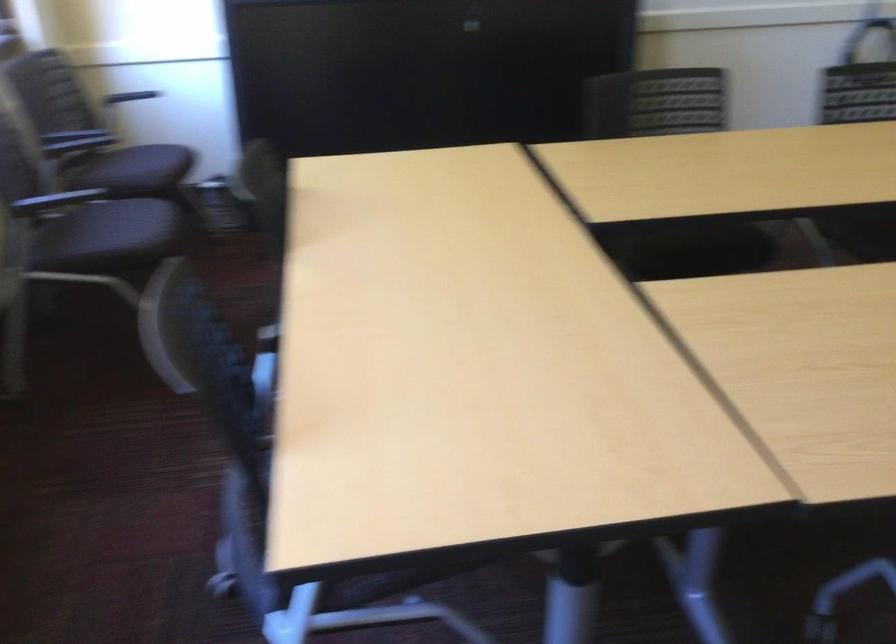
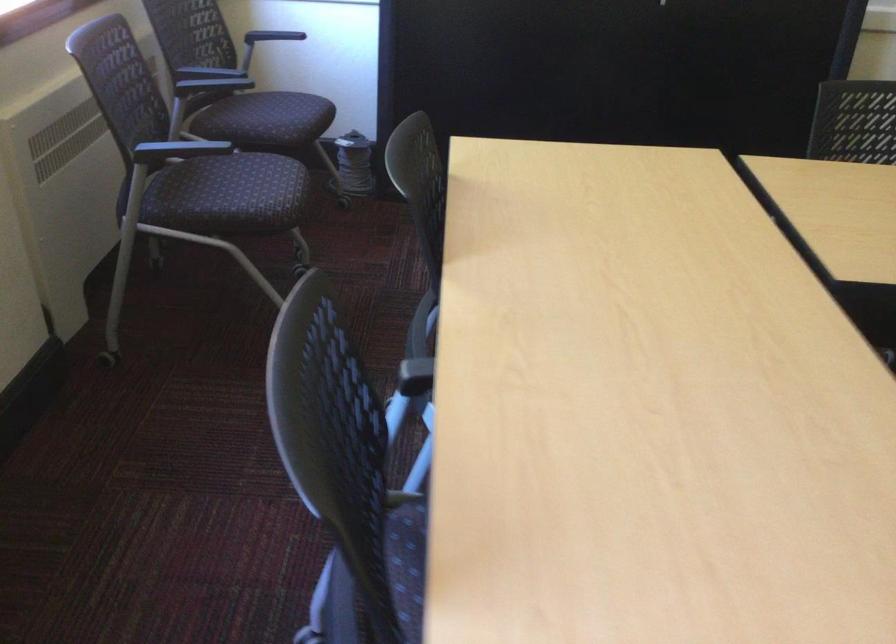
Question: The camera is either moving clockwise (left) or counter-clockwise (right) around the object. The first image is from the beginning of the video and the second image is from the end. Is the camera moving left or right when shooting the video?

Choices:
 (A) Left
 (B) Right

Answer: (B)